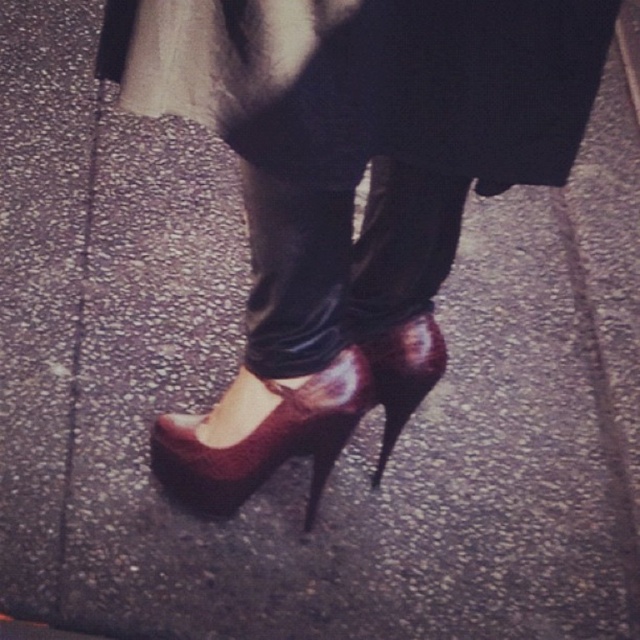
Question: Considering the relative positions of shiny burgundy high-heeled shoe at center and metallic silver curb at lower right in the image provided, where is shiny burgundy high-heeled shoe at center located with respect to metallic silver curb at lower right?

Choices:
 (A) right
 (B) left

Answer: (B)

Question: Which point is farther from the camera taking this photo?

Choices:
 (A) tap(378, 392)
 (B) tap(336, 403)
 (C) tap(636, 4)

Answer: (C)

Question: Based on their relative distances, which object is nearer to the metallic silver curb at lower right?

Choices:
 (A) shiny burgundy leather high-heeled shoe at center
 (B) shiny burgundy high-heeled shoe at center

Answer: (B)

Question: Is shiny burgundy high-heeled shoe at center positioned before metallic silver curb at lower right?

Choices:
 (A) no
 (B) yes

Answer: (B)

Question: Which point is farther to the camera?

Choices:
 (A) [180, 484]
 (B) [417, 342]
 (C) [630, 88]

Answer: (C)

Question: Does shiny burgundy leather high-heeled shoe at center have a smaller size compared to metallic silver curb at lower right?

Choices:
 (A) yes
 (B) no

Answer: (B)